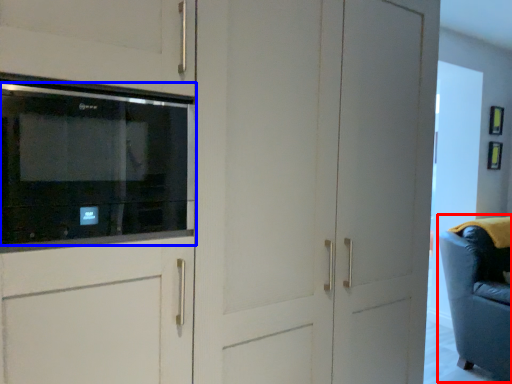
Question: Which of the following is the closest to the observer, swivel chair (highlighted by a red box) or microwave oven (highlighted by a blue box)?

Choices:
 (A) swivel chair
 (B) microwave oven

Answer: (B)